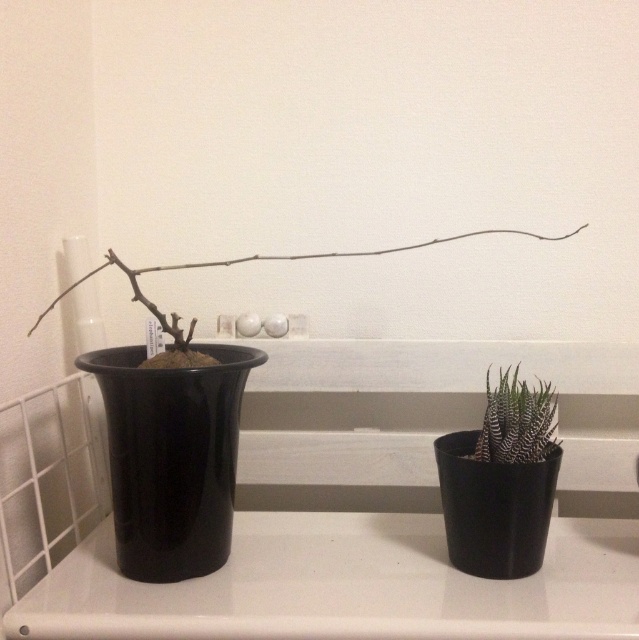
In the scene shown: You are a gardener who needs to water both plants. The watering can you have is 14 inches wide. Can you place the watering can between the textured black pot at right and the brown matte branch at center without touching either?

The distance between the textured black pot at right and the brown matte branch at center is 12.61 inches. Since the watering can is 14 inches wide, it cannot fit between them without overlapping either object.

You are organizing a shelf and need to place a tall decorative item between the black glossy vase at lower right and the textured black pot at right. Can you fit it there?

The black glossy vase at lower right is much taller than the textured black pot at right. Since the vase is taller, there might not be enough vertical space between them to fit another tall item unless the shelf is deep enough. However, the description only mentions their height, not the horizontal distance between them. Without information on the horizontal spacing, it is uncertain if there is enough room.

You are organizing a shelf and need to ensure that the items on it are stable. Given the description, which object between the textured black pot at right and the brown matte branch at center is more likely to tip over, and why?

The textured black pot at right is more likely to tip over because it is shorter than the brown matte branch at center, making it less stable due to its lower center of gravity and potentially narrower base.